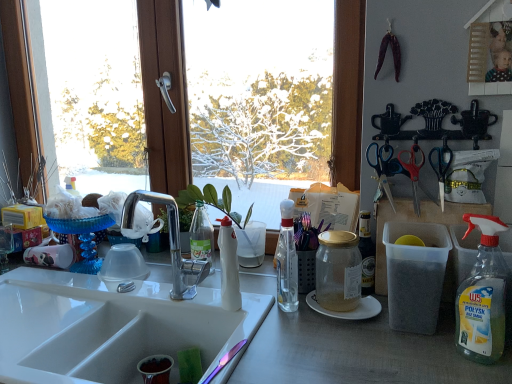
Question: Is clear plastic bottle at right, the fourth bottle when ordered from left to right, taller or shorter than gold glass jar at center, acting as the third bottle starting from the left?

Choices:
 (A) short
 (B) tall

Answer: (B)

Question: Considering the positions of clear plastic bottle at right, the fourth bottle when ordered from left to right, and gold glass jar at center, the 2th bottle viewed from the right, in the image, is clear plastic bottle at right, the fourth bottle when ordered from left to right, wider or thinner than gold glass jar at center, the 2th bottle viewed from the right,?

Choices:
 (A) thin
 (B) wide

Answer: (A)

Question: Estimate the real-world distances between objects in this image. Which object is farther from the white glossy sink at lower left?

Choices:
 (A) blue plastic scissors at upper right, which is counted as the 3th scissors, starting from the left
 (B) blue plastic scissors at upper right, which appears as the 1th scissors when viewed from the left
 (C) white glossy coffee cup at left
 (D) white matte bottle at center, the fourth bottle from the right
 (E) satin nickel faucet at sink center

Answer: (C)

Question: Based on their relative distances, which object is farther from the gold glass jar at center, the 2th bottle viewed from the right?

Choices:
 (A) transparent glass window at center
 (B) clear glass bottle at center, the second bottle in the left-to-right sequence
 (C) white glossy sink at lower left
 (D) satin nickel faucet at sink center
 (E) red plastic scissors at upper right, the 2th scissors in the left-to-right sequence

Answer: (A)